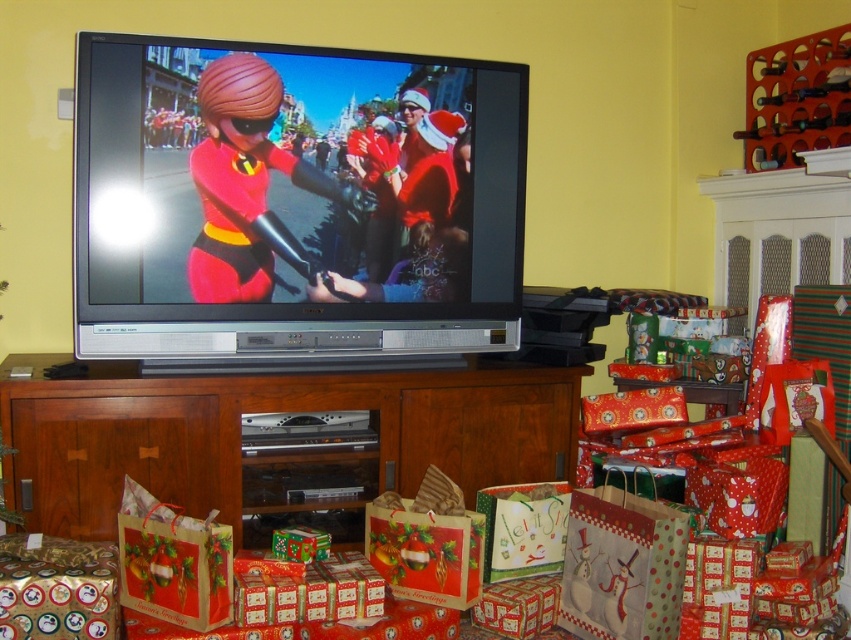
You are a drone operator trying to deliver a small package to the living room shown. You have two points marked in the scene, point (287, 264) and point (358, 490). Which point is closer to you as you fly the drone?

Point (287, 264) is closer to the viewer than point (358, 490).

You are standing in the living room and want to place a new Christmas decoration exactly at the center of the matte black television at upper center. According to the coordinates provided, where should you place the decoration?

The center of the matte black television at upper center is at point coordinates (294, 200), so you should place the decoration there.